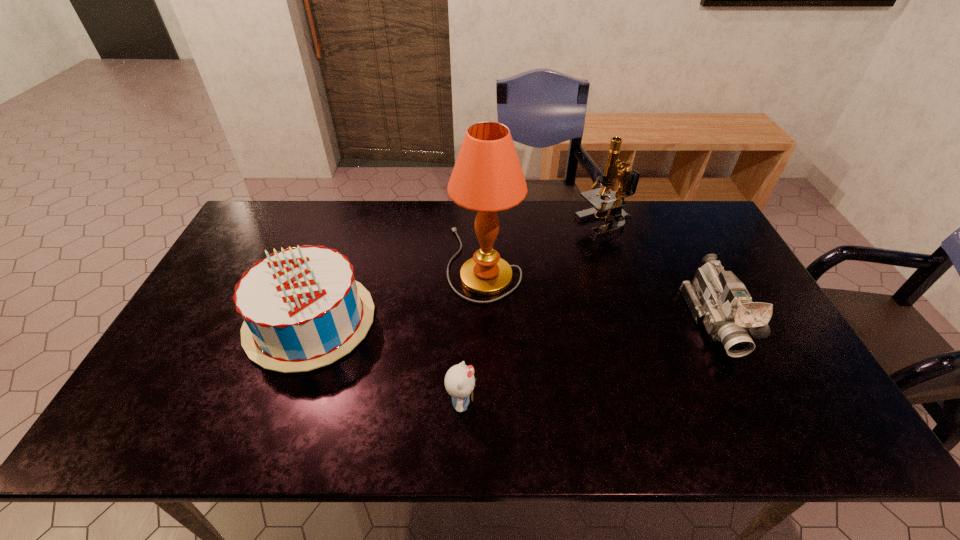
In order to click on free spot between the lamp and the rightmost object in this screenshot , I will do `click(599, 292)`.

This screenshot has height=540, width=960. I want to click on vacant space in between the leftmost object and the camcorder, so click(513, 321).

This screenshot has width=960, height=540. I want to click on free space that is in between the tallest object and the nearest object, so pos(473,333).

The height and width of the screenshot is (540, 960). I want to click on free space between the camcorder and the tallest object, so click(x=599, y=292).

Locate which object is the fourth closest to the leftmost object. Please provide its 2D coordinates. Your answer should be formatted as a tuple, i.e. [(x, y)], where the tuple contains the x and y coordinates of a point satisfying the conditions above.

[(716, 298)]

This screenshot has width=960, height=540. I want to click on the third closest object to the tallest object, so click(x=459, y=381).

Where is `vacant space that satisfies the following two spatial constraints: 1. at the eyepiece of the second object from right to left; 2. on the front side of the leftmost object`? This screenshot has width=960, height=540. vacant space that satisfies the following two spatial constraints: 1. at the eyepiece of the second object from right to left; 2. on the front side of the leftmost object is located at coordinates (638, 321).